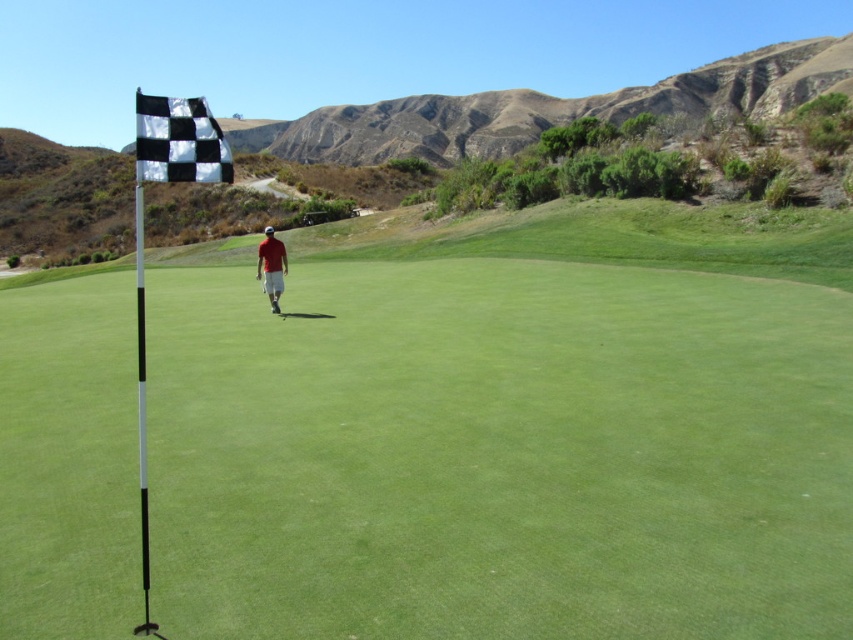
You are a golfer standing at the center of the green. You see the point marked at coordinates (508,428). What object is located at that point?

The point at coordinates (508,428) marks the white plastic flag at left.

You are a golfer trying to determine which flag to aim for on the green. The white plastic flag at left and the black checkered flag at upper left are both visible. Which flag has a wider physical size?

The white plastic flag at left has a larger width than the black checkered flag at upper left according to the description.

You are a golfer trying to determine the direction to the hole from your current position. You notice the white plastic flag at left and the red matte shirt at center. Which object is positioned further to the left?

The white plastic flag at left is positioned further to the left compared to the red matte shirt at center.